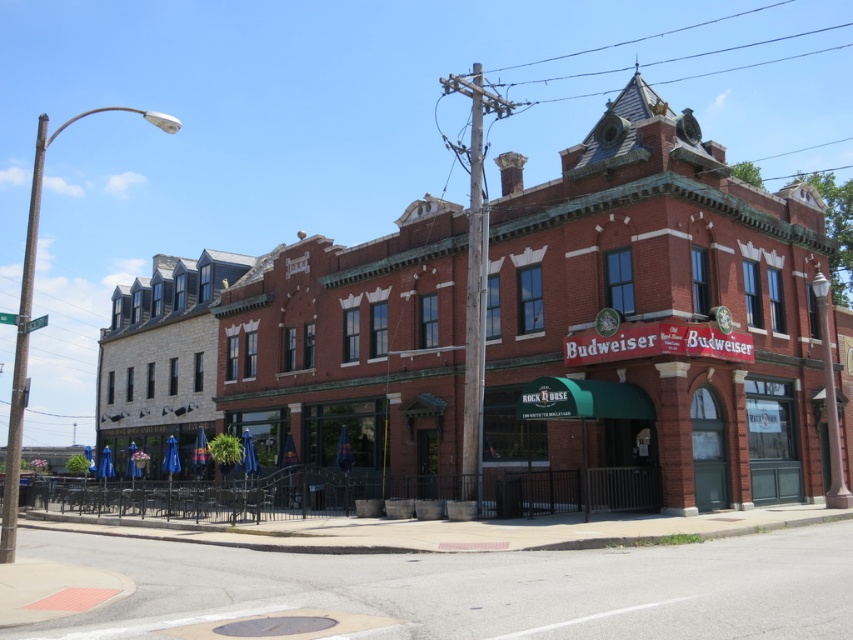
Consider the image. Can you confirm if red brick building at center is positioned above concrete sidewalk at lower center?

Indeed, red brick building at center is positioned over concrete sidewalk at lower center.

Is point (743, 256) less distant than point (834, 628)?

No, it is behind (834, 628).

Is point (509, 298) farther from viewer compared to point (576, 627)?

Yes, point (509, 298) is farther from viewer.

Where is `red brick building at center`? The height and width of the screenshot is (640, 853). red brick building at center is located at coordinates (653, 321).